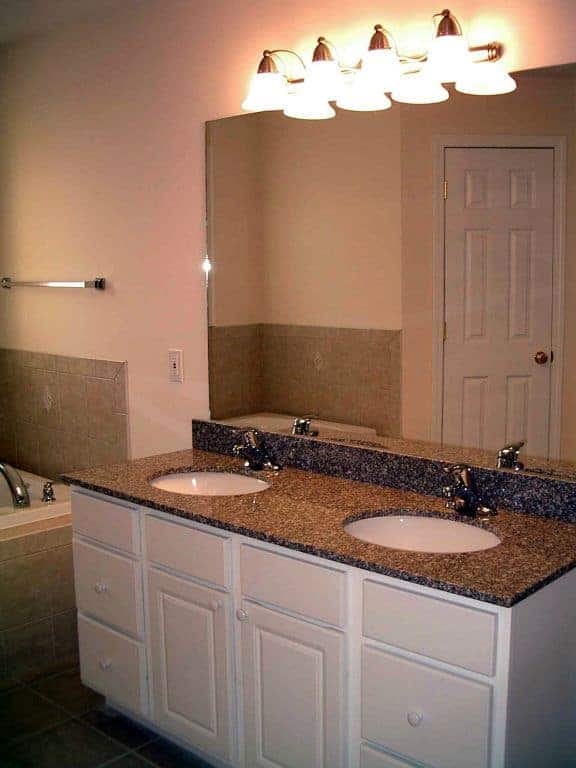
What are the coordinates of `countertop` in the screenshot? It's located at (314, 528).